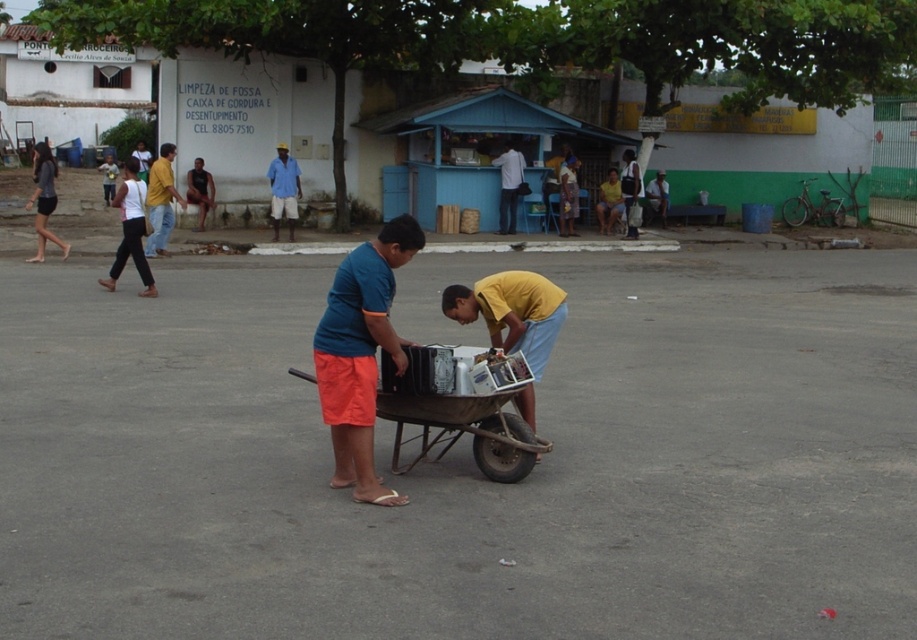
You are standing in the village square and see the brown wooden cart at center and the blue cotton shirt at center. Which object is closer to you?

The brown wooden cart at center is closer to the viewer than the blue cotton shirt at center.

You are a delivery person who needs to move a large package that is 1 meter wide. You see the brown wooden cart at center and the yellow cotton shirt at center. Which object can accommodate the package based on their widths?

The brown wooden cart at center can accommodate the large 1 meter wide package since its width surpasses that of the yellow cotton shirt at center.

Based on the photo, you are a delivery person who needs to load a 1.8 meter tall package into either the brown wooden cart at center or the blue cotton shirt at center. Which object can accommodate the package based on height?

The brown wooden cart at center is not as tall as the blue cotton shirt at center. Since the package is 1.8 meters tall, the blue cotton shirt at center may be able to accommodate it if its height is sufficient, but the brown wooden cart at center is shorter and likely cannot. However, the exact height of the blue cotton shirt isn